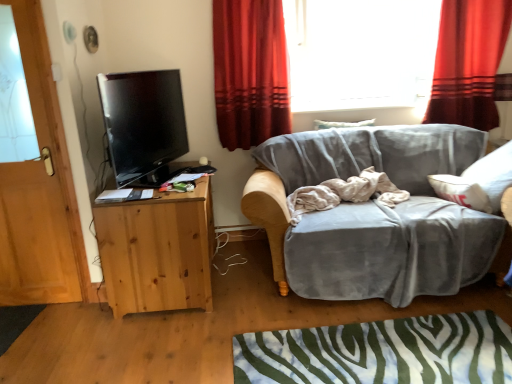
Find the location of a particular element. Image resolution: width=512 pixels, height=384 pixels. free spot in front of natural wood cabinet at left is located at coordinates (142, 343).